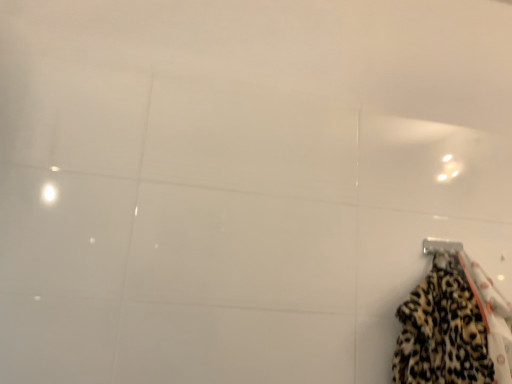
Describe the element at coordinates (441, 246) in the screenshot. The height and width of the screenshot is (384, 512). I see `clear plastic hanger at right` at that location.

Find the location of a particular element. This screenshot has width=512, height=384. clear plastic hanger at right is located at coordinates (441, 246).

Locate an element on the screen. The image size is (512, 384). clear plastic hanger at right is located at coordinates (441, 246).